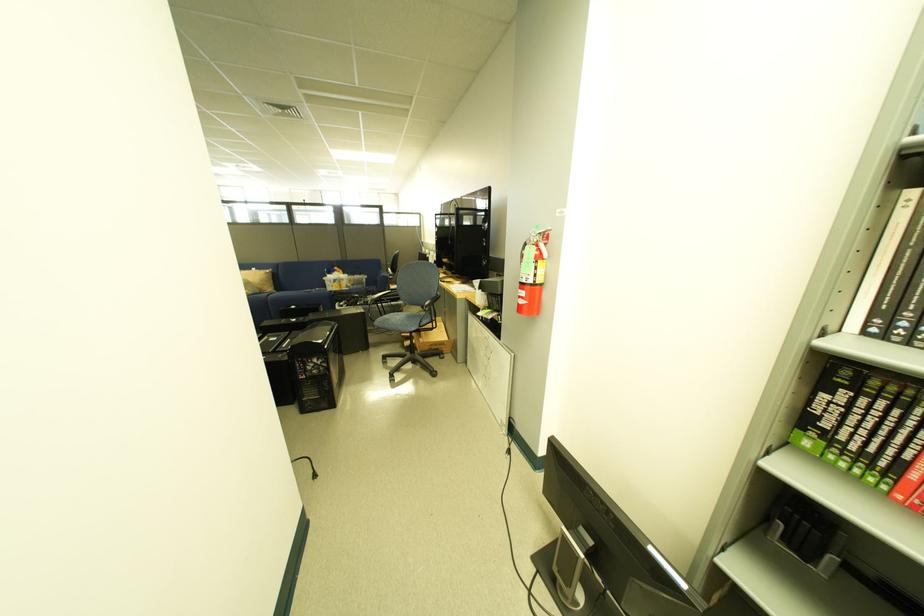
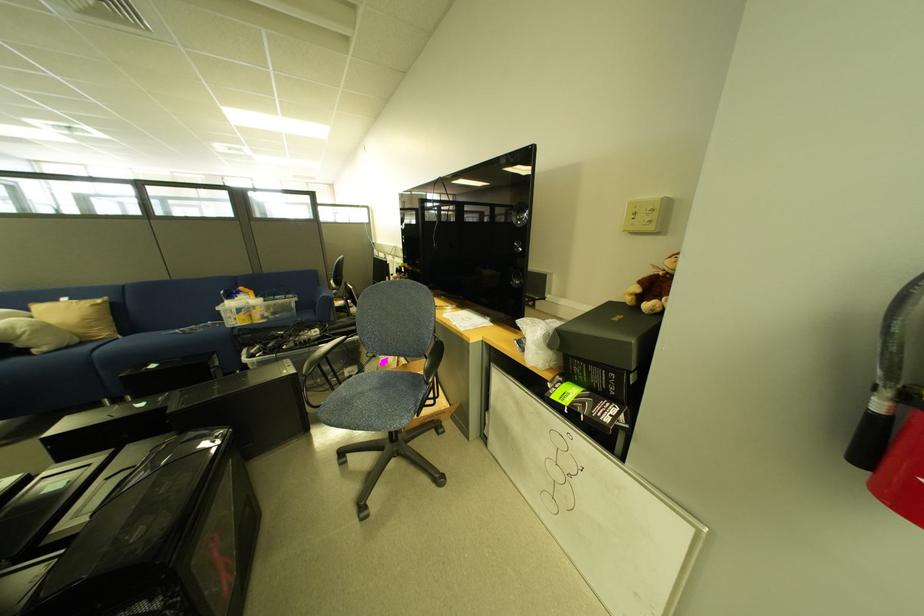
Locate, in the second image, the point that corresponds to (383,291) in the first image.

(319, 318)